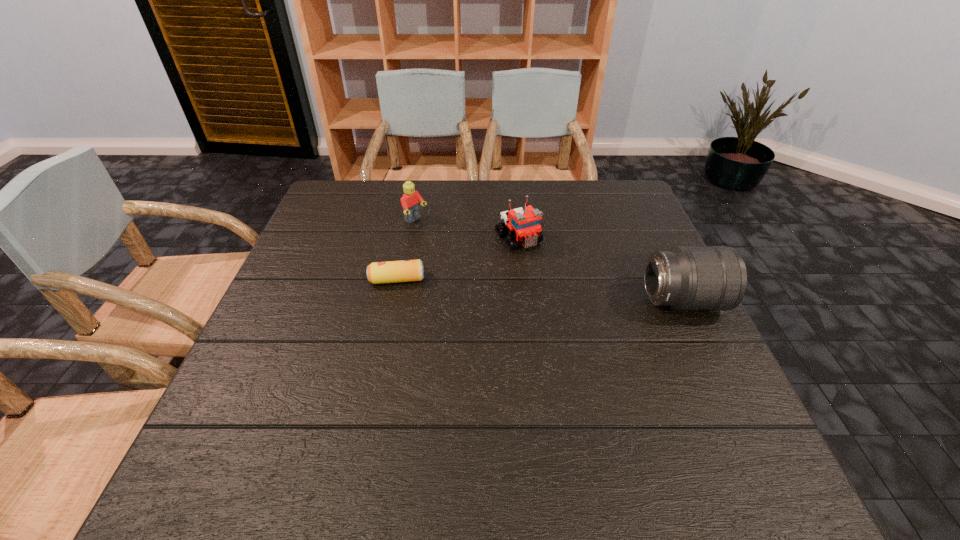
Locate an element on the screen. vacant space on the desktop that is between the shortest object and the rightmost object and is positioned on the face of the left Lego is located at coordinates (527, 289).

Where is `free spot on the desktop that is between the shortest object and the rightmost object and is positioned on the front-facing side of the third object from left to right`? The image size is (960, 540). free spot on the desktop that is between the shortest object and the rightmost object and is positioned on the front-facing side of the third object from left to right is located at coordinates (563, 292).